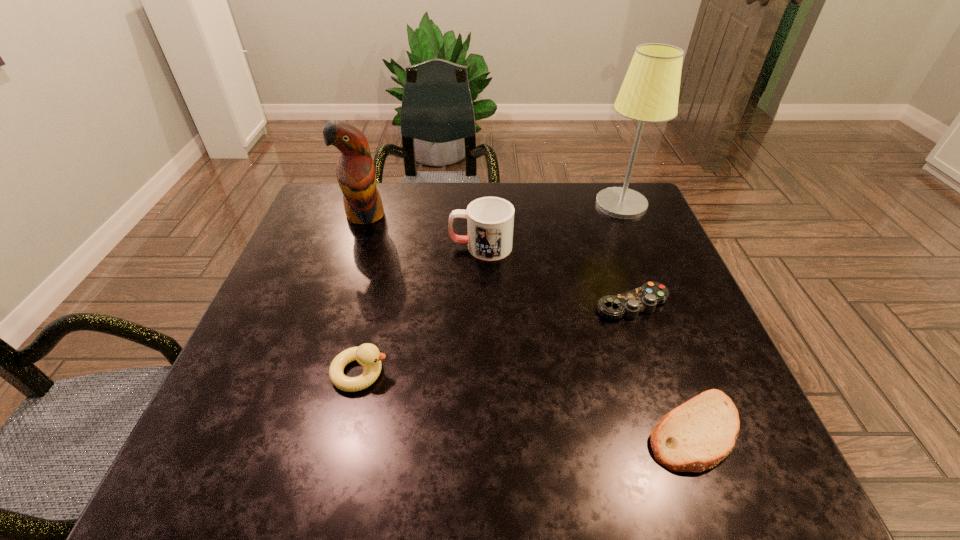
This screenshot has width=960, height=540. I want to click on table lamp, so click(x=650, y=91).

What are the coordinates of `parrot` in the screenshot? It's located at (356, 174).

This screenshot has height=540, width=960. I want to click on mug, so click(490, 220).

The height and width of the screenshot is (540, 960). I want to click on the fourth object from right to left, so click(490, 220).

I want to click on the fourth tallest object, so click(368, 355).

In order to click on control in this screenshot , I will do `click(645, 298)`.

In order to click on pita bread in this screenshot , I will do `click(696, 436)`.

I want to click on free space located on the left of the tallest object, so click(553, 204).

At what (x,y) coordinates should I click in order to perform the action: click on vacant space situated on the face of the parrot. Please return your answer as a coordinate pair (x, y). Image resolution: width=960 pixels, height=540 pixels. Looking at the image, I should click on (330, 322).

This screenshot has width=960, height=540. I want to click on vacant point located 0.240m on the side of the third tallest object with the handle, so click(356, 246).